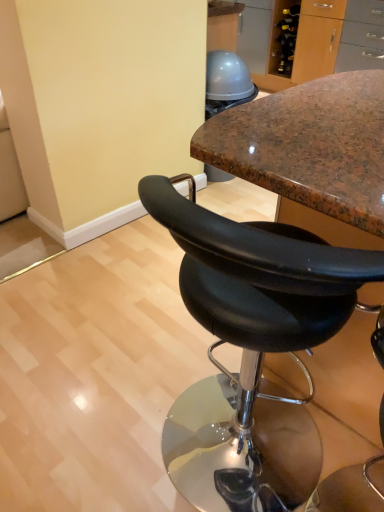
Question: Considering the positions of black leather stool at center, which appears as the second chair when viewed from the left, and black leather stool at center, marked as the 1th chair in a left-to-right arrangement, in the image, is black leather stool at center, which appears as the second chair when viewed from the left, wider or thinner than black leather stool at center, marked as the 1th chair in a left-to-right arrangement,?

Choices:
 (A) thin
 (B) wide

Answer: (B)

Question: Relative to black leather stool at center, marked as the 1th chair in a left-to-right arrangement, is black leather stool at center, which is the 1th chair in right-to-left order, in front or behind?

Choices:
 (A) front
 (B) behind

Answer: (B)

Question: Based on their positions, is black leather stool at center, which appears as the second chair when viewed from the left, located to the left or right of black leather stool at center, which is counted as the 2th chair, starting from the right?

Choices:
 (A) right
 (B) left

Answer: (A)

Question: From the image's perspective, is black leather stool at center, marked as the 1th chair in a left-to-right arrangement, located above or below black leather stool at center, which is the 1th chair in right-to-left order?

Choices:
 (A) below
 (B) above

Answer: (A)

Question: From their relative heights in the image, would you say black leather stool at center, which is counted as the 2th chair, starting from the right, is taller or shorter than black leather stool at center, which is the 1th chair in right-to-left order?

Choices:
 (A) short
 (B) tall

Answer: (A)

Question: Is black leather stool at center, marked as the 1th chair in a left-to-right arrangement, in front of or behind black leather stool at center, which appears as the second chair when viewed from the left, in the image?

Choices:
 (A) behind
 (B) front

Answer: (B)

Question: From a real-world perspective, is black leather stool at center, marked as the 1th chair in a left-to-right arrangement, physically located above or below black leather stool at center, which is the 1th chair in right-to-left order?

Choices:
 (A) below
 (B) above

Answer: (A)